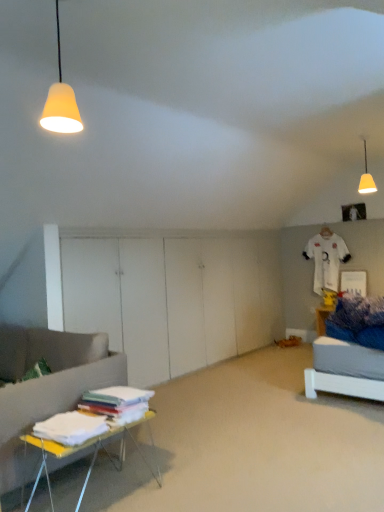
Identify the location of vacant point above white plastic table at lower left (from a real-world perspective). (84, 424).